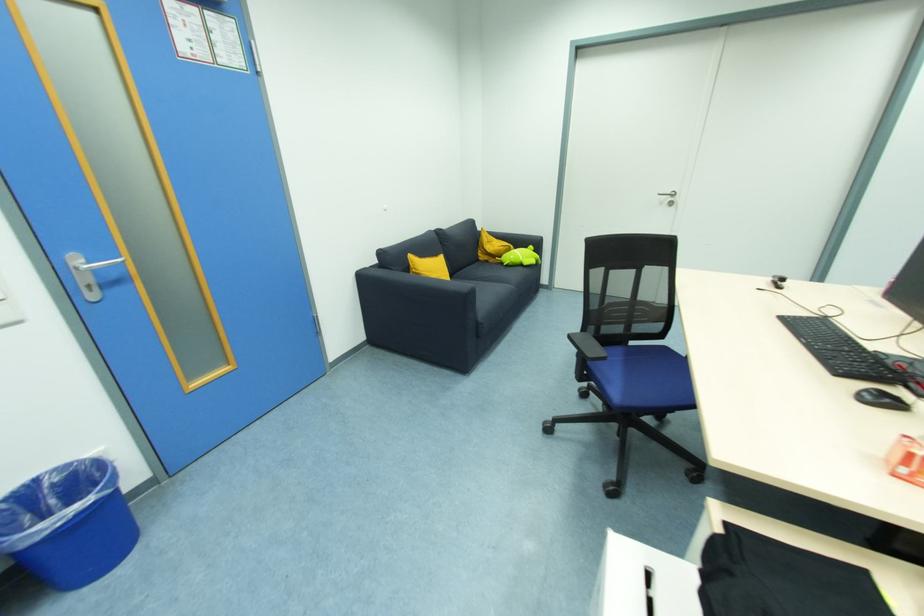
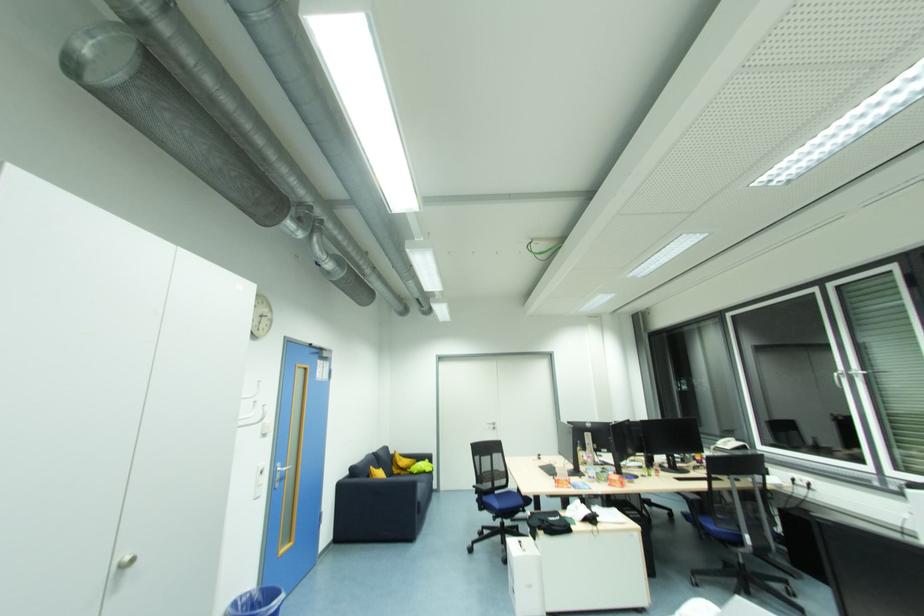
Where in the second image is the point corresponding to the point at 484,259 from the first image?

(398, 472)